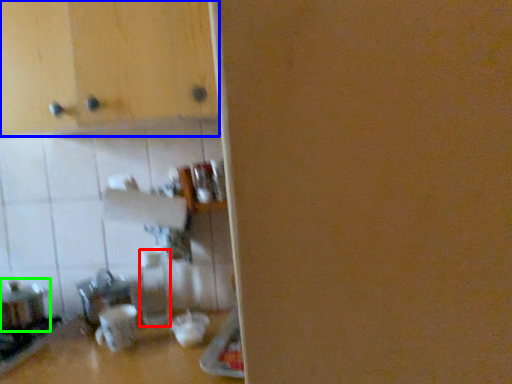
Question: Which object is the closest to the bottle (highlighted by a red box)? Choose among these: cabinetry (highlighted by a blue box) or appliance (highlighted by a green box).

Choices:
 (A) cabinetry
 (B) appliance

Answer: (B)